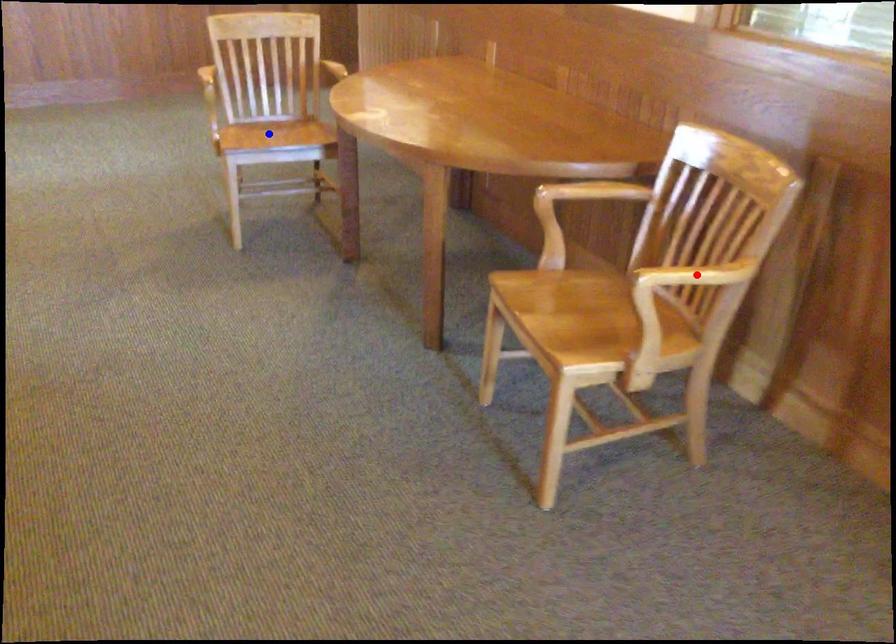
Question: Which of the two points in the image is closer to the camera?

Choices:
 (A) Blue point is closer.
 (B) Red point is closer.

Answer: (B)